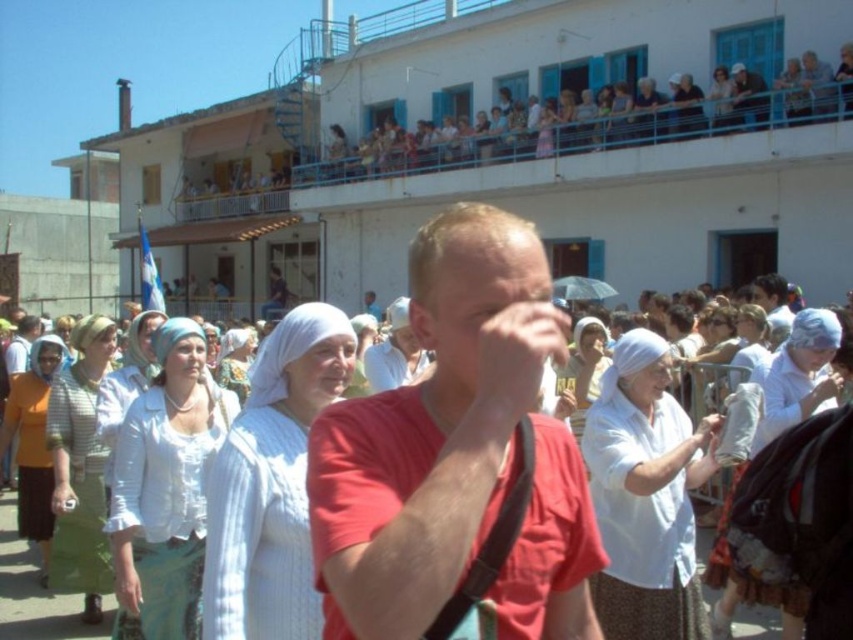
You are standing at the point marked as point [456,452] in the image. Which object from the scene are you currently standing on?

You are standing on the red matte shirt at center as the point [456,452] is located on it.